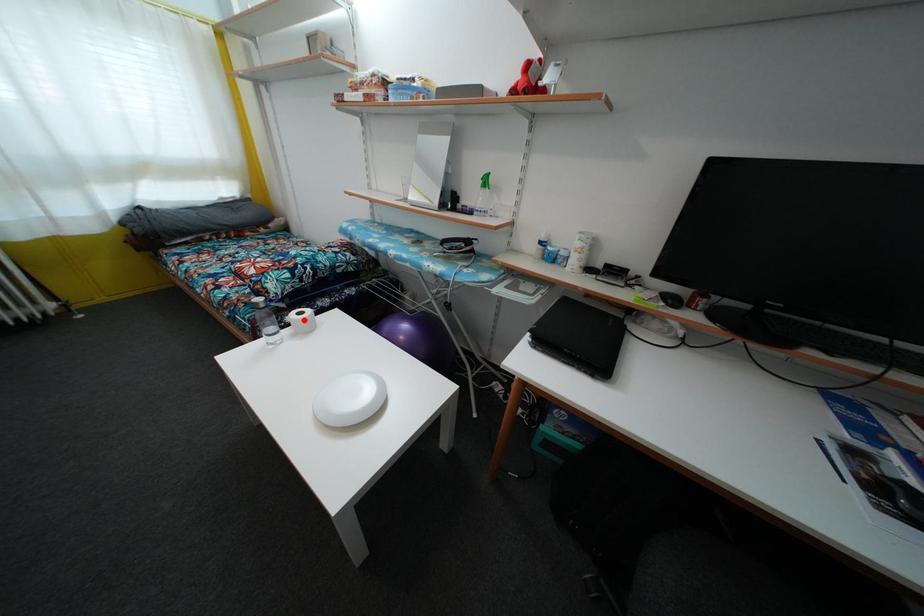
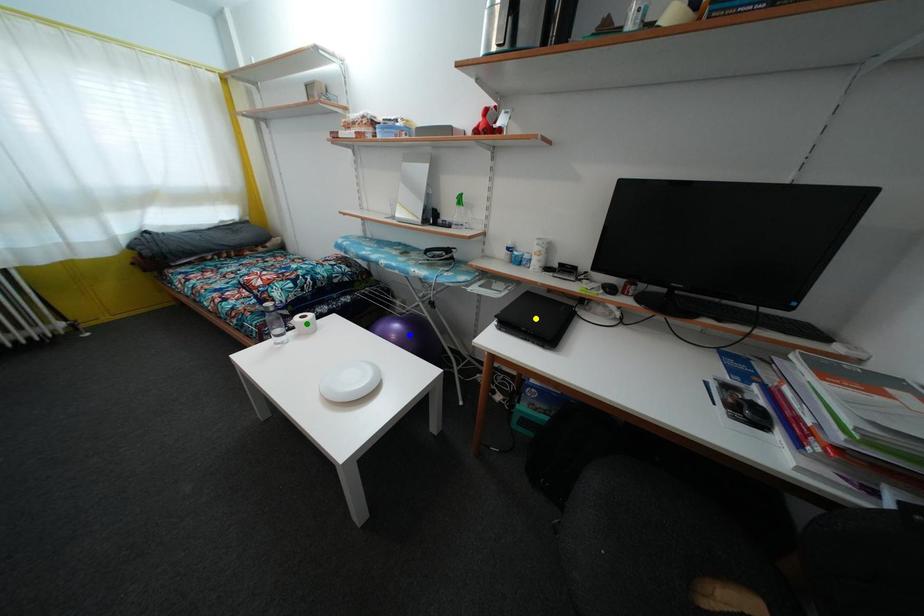
Question: I am providing you with two images of the same scene from different viewpoints. A red point is marked on the first image. You are given multiple points on the second image. In image 2, which mark is for the same physical point as the one in image 1?

Choices:
 (A) yellow point
 (B) blue point
 (C) green point

Answer: (C)